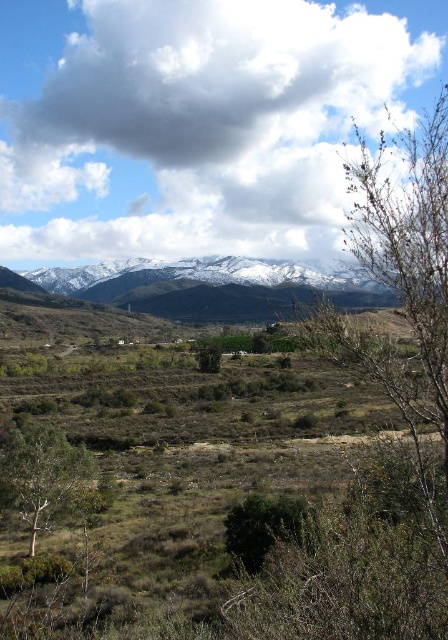
Question: Considering the real-world distances, which object is farthest from the green leafy tree at lower left?

Choices:
 (A) white snow-covered mountain range at upper center
 (B) bare branches at right

Answer: (A)

Question: Does bare branches at right have a smaller size compared to white snow-covered mountain range at upper center?

Choices:
 (A) no
 (B) yes

Answer: (A)

Question: Estimate the real-world distances between objects in this image. Which object is closer to the white fluffy cloud at upper center?

Choices:
 (A) bare branches at right
 (B) green leafy tree at center

Answer: (A)

Question: Is bare branches at right positioned in front of green leafy tree at center?

Choices:
 (A) yes
 (B) no

Answer: (A)

Question: From the image, what is the correct spatial relationship of white snow-covered mountain range at upper center in relation to green leafy tree at center?

Choices:
 (A) left
 (B) right

Answer: (A)

Question: Which of these objects is positioned closest to the white snow-covered mountain range at upper center?

Choices:
 (A) green leafy tree at center
 (B) green leafy tree at lower left
 (C) white fluffy cloud at upper center

Answer: (C)